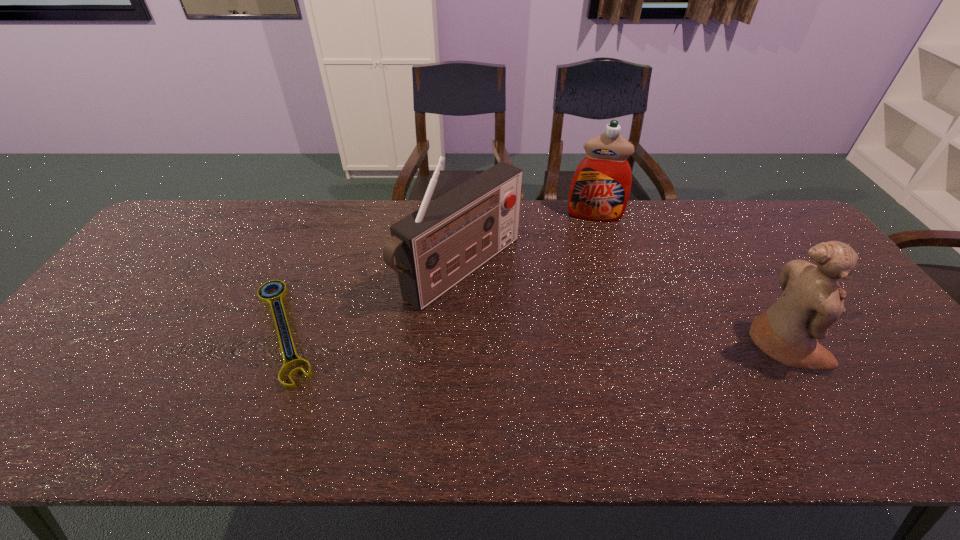
Where is `free spot at the left edge of the desktop`? The width and height of the screenshot is (960, 540). free spot at the left edge of the desktop is located at coordinates (162, 271).

Where is `vacant space at the right edge`? The height and width of the screenshot is (540, 960). vacant space at the right edge is located at coordinates (804, 247).

Locate an element on the screen. This screenshot has height=540, width=960. vacant space at the far right corner of the desktop is located at coordinates (743, 207).

At what (x,y) coordinates should I click in order to perform the action: click on free area in between the third object from right to left and the rightmost object. Please return your answer as a coordinate pair (x, y). The image size is (960, 540). Looking at the image, I should click on (621, 307).

Identify the location of free space between the figurine and the wrench. (533, 338).

Identify the location of vacant space that's between the radio receiver and the wrench. The height and width of the screenshot is (540, 960). (372, 300).

Find the location of a particular element. Image resolution: width=960 pixels, height=540 pixels. empty space that is in between the rightmost object and the second object from left to right is located at coordinates (621, 307).

This screenshot has width=960, height=540. I want to click on vacant region between the detergent and the figurine, so click(688, 280).

The height and width of the screenshot is (540, 960). In order to click on free point between the rightmost object and the detergent in this screenshot , I will do `click(688, 280)`.

Identify which object is the nearest to the shortest object. Please provide its 2D coordinates. Your answer should be formatted as a tuple, i.e. [(x, y)], where the tuple contains the x and y coordinates of a point satisfying the conditions above.

[(435, 247)]